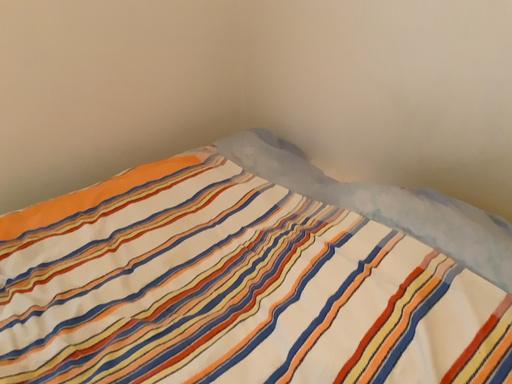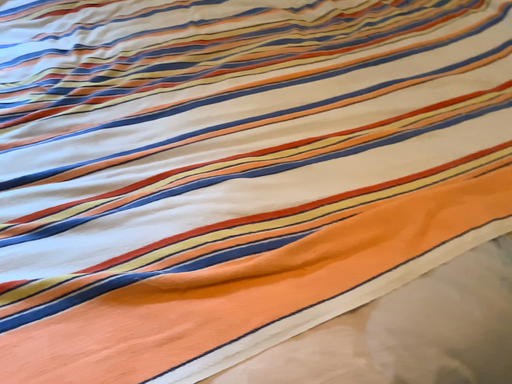
Question: How did the camera likely rotate when shooting the video?

Choices:
 (A) rotated downward
 (B) rotated upward

Answer: (A)